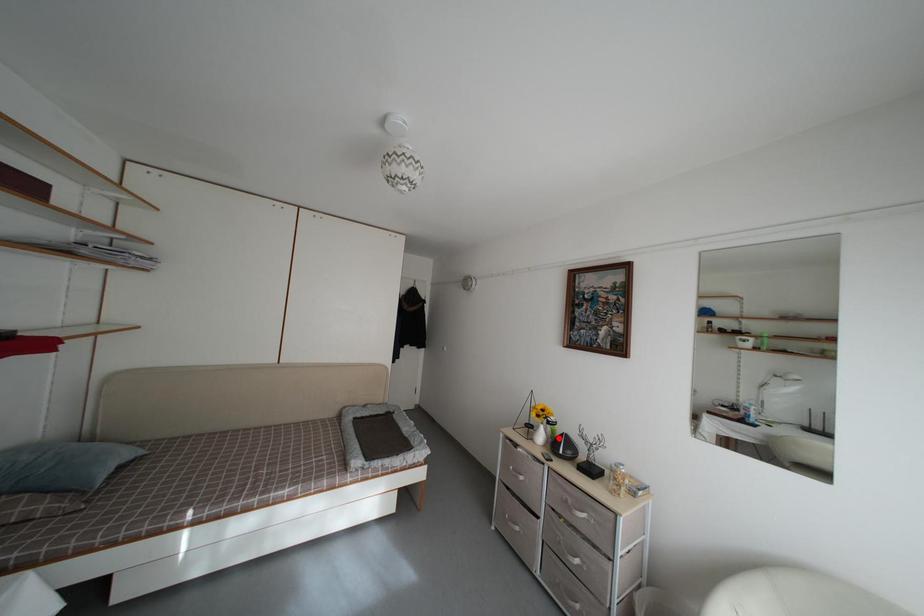
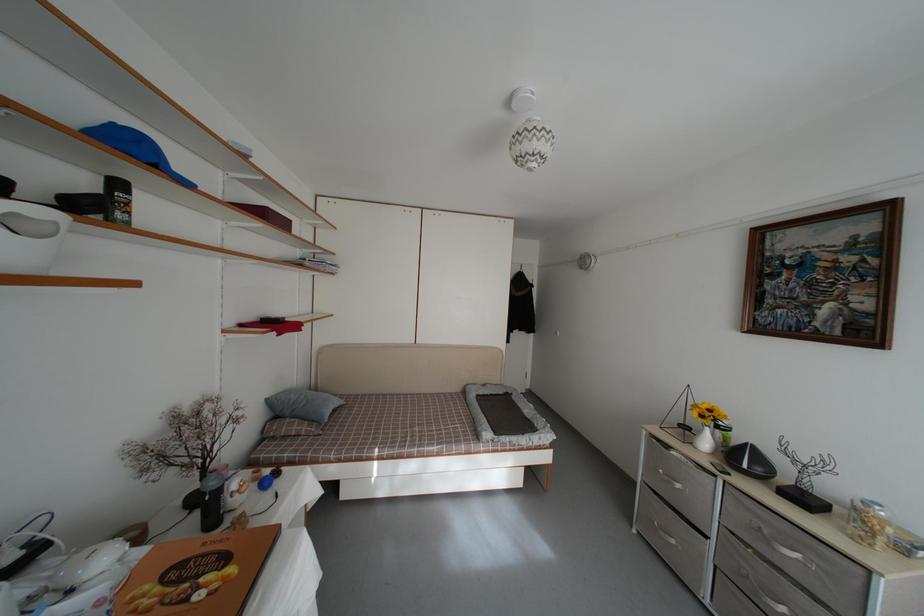
Question: I am providing you with two images of the same scene from different viewpoints. Given a red point in image1, look at the same physical point in image2. Is it:

Choices:
 (A) Closer to the viewpoint
 (B) Farther from the viewpoint

Answer: (A)